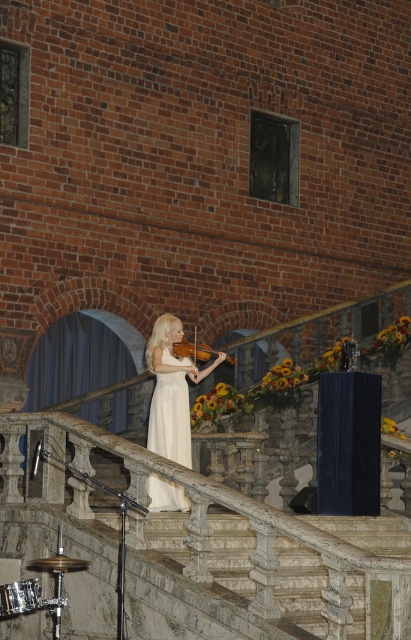
You are an architect examining the building from the outside. You notice the white satin dress at center and the wooden violin at center in the image. Which object is positioned lower in the scene?

The white satin dress at center is positioned lower than the wooden violin at center in the scene.

You are a photographer positioned at the base of the marble staircase. You want to take a photo of the woman in the white satin dress at center while ensuring the intricate stone balustrades are also in the frame. Given that the dress and balustrades are 13.12 meters apart, will you be able to capture both in a single shot without moving your position?

The white satin dress at center and the intricate stone balustrades are 13.12 meters apart. Since the photographer is at the base of the marble staircase, the distance between them allows both elements to be captured in a single shot without needing to move, as modern cameras can focus on subjects at varying distances within the same frame.